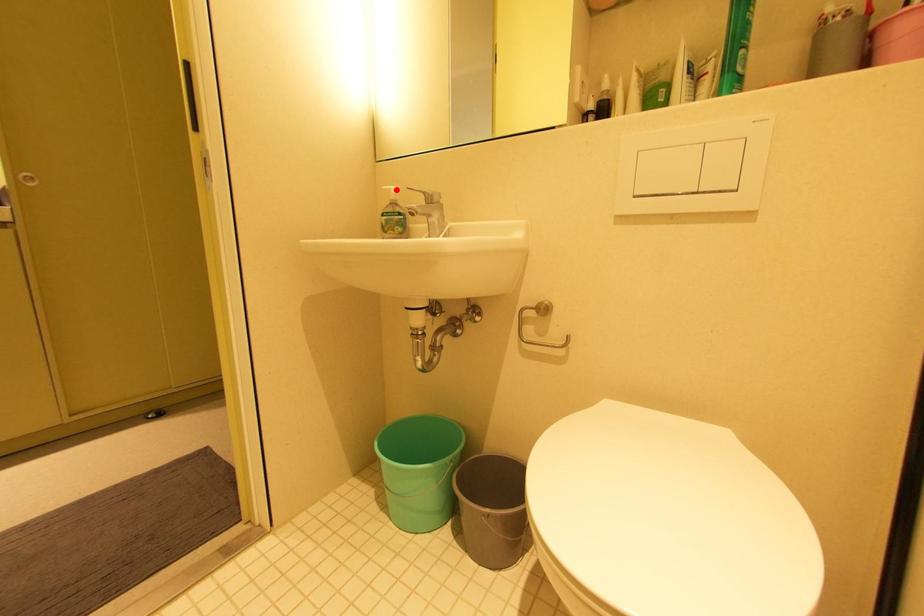
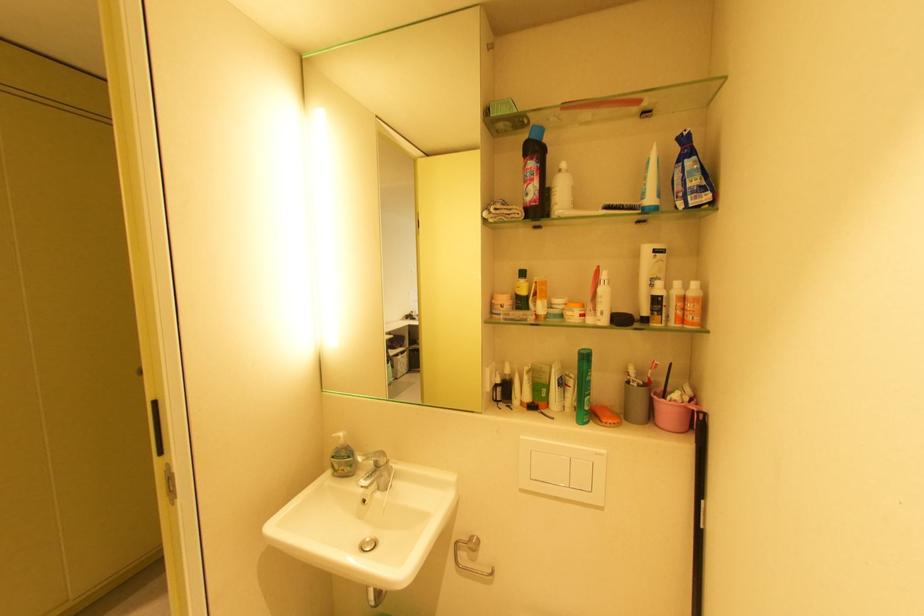
Question: I am providing you with two images of the same scene from different viewpoints. Image1 has a red point marked. In image2, the corresponding 3D location appears at what relative position? Reply with the corresponding letter.

Choices:
 (A) Closer
 (B) Farther

Answer: (B)